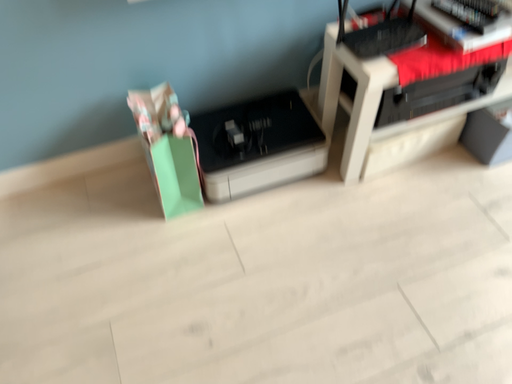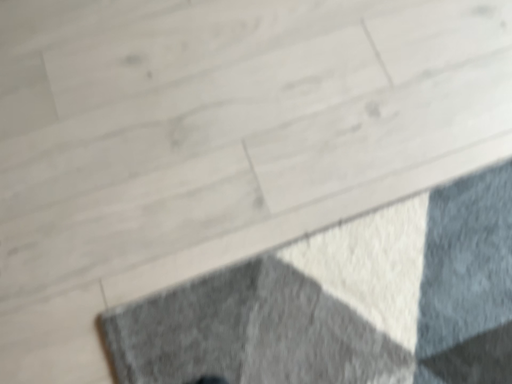
Question: How did the camera likely rotate when shooting the video?

Choices:
 (A) rotated upward
 (B) rotated downward

Answer: (B)